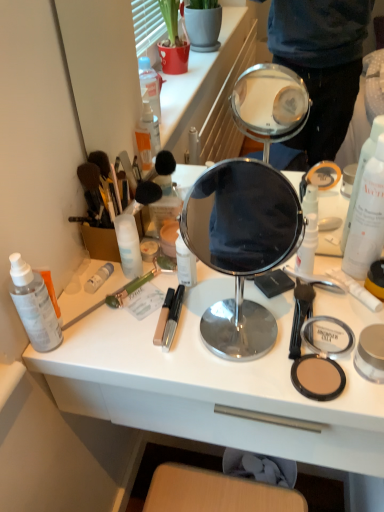
At what (x,y) coordinates should I click in order to perform the action: click on free area in between white matte tube at left, the 4th toiletry when ordered from right to left, and matte yellow compact powder at right, the first toiletry when ordered from right to left. Please return your answer as a coordinate pair (x, y). This screenshot has height=512, width=384. Looking at the image, I should click on (221, 286).